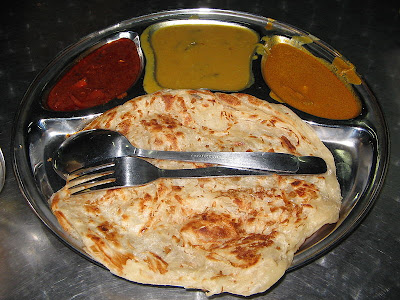
Where is `rim on bowl`? This screenshot has width=400, height=300. rim on bowl is located at coordinates (36, 86), (27, 178), (370, 193), (377, 109).